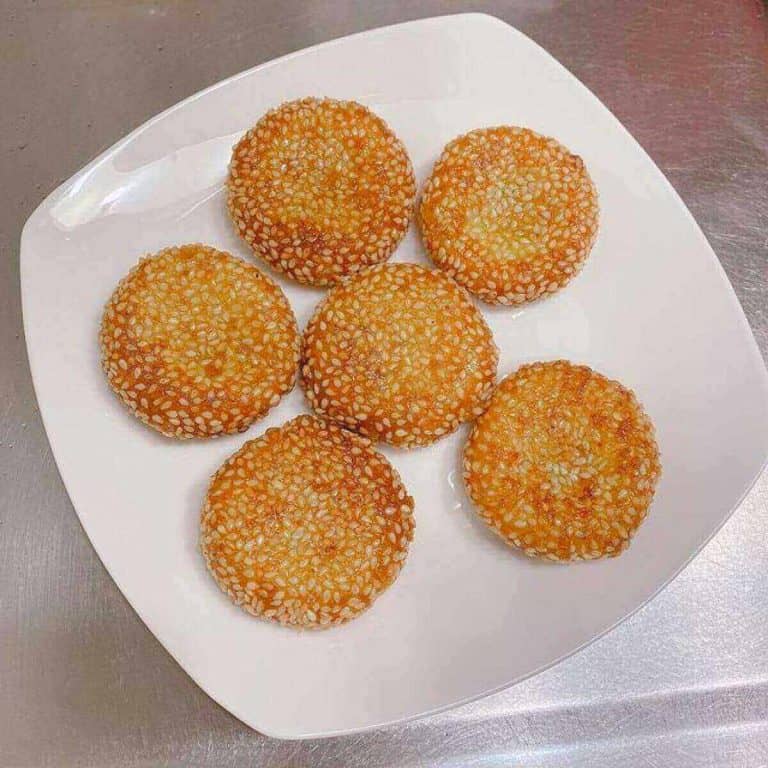
Where is `white dish`? This screenshot has width=768, height=768. white dish is located at coordinates (647, 363).